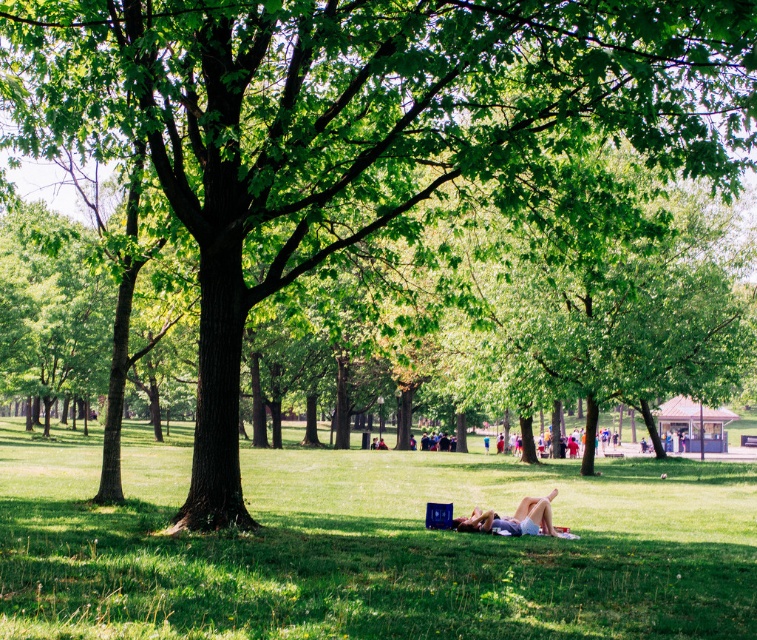
Based on the photo, you are a photographer planning to take a photo of the green grassy at center and the light blue denim shorts at center in the park. Which object should you focus on first if you want to capture both in sharp focus?

The green grassy at center should be focused on first because it has a larger size compared to the light blue denim shorts at center, ensuring both are in focus when using depth of field techniques.